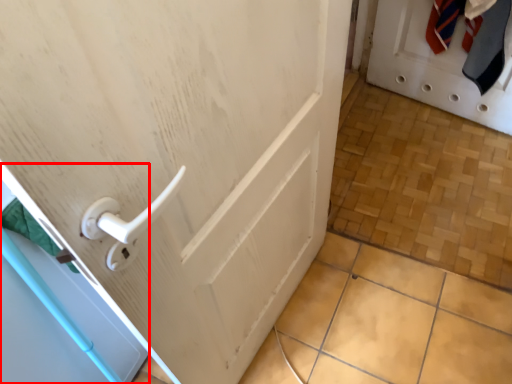
Question: From the image's perspective, what is the correct spatial positioning of screen door (annotated by the red box) in reference to door?

Choices:
 (A) above
 (B) below

Answer: (B)